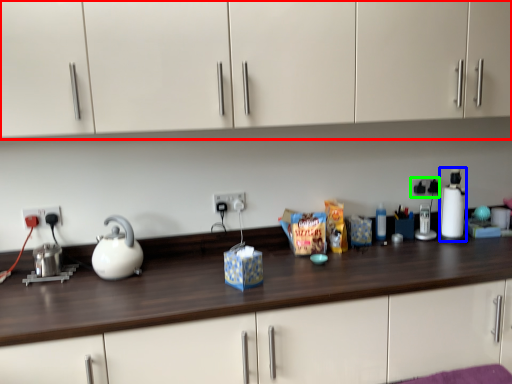
Question: Which is nearer to the cabinetry (highlighted by a red box)? blender (highlighted by a blue box) or electric outlet (highlighted by a green box).

Choices:
 (A) blender
 (B) electric outlet

Answer: (A)